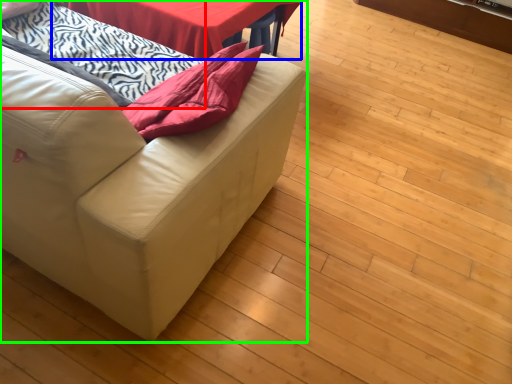
Question: Which is farther away from blanket (highlighted by a red box)? table (highlighted by a blue box) or studio couch (highlighted by a green box)?

Choices:
 (A) table
 (B) studio couch

Answer: (B)